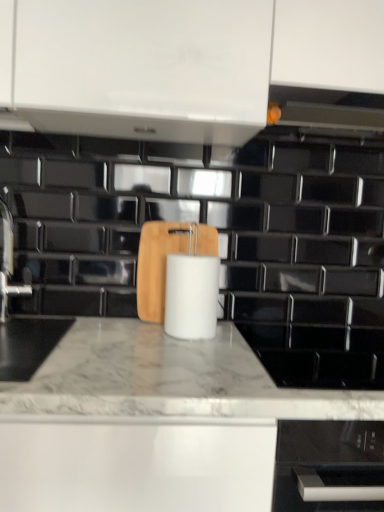
Question: In terms of width, does wooden cutting board at center look wider or thinner when compared to satin nickel faucet at left?

Choices:
 (A) wide
 (B) thin

Answer: (B)

Question: From a real-world perspective, is wooden cutting board at center physically located above or below satin nickel faucet at left?

Choices:
 (A) below
 (B) above

Answer: (A)

Question: Which is farther from the wooden cutting board at center?

Choices:
 (A) white matte paper towel at center
 (B) satin nickel faucet at left
 (C) white marble countertop at center

Answer: (C)

Question: Considering the real-world distances, which object is closest to the satin nickel faucet at left?

Choices:
 (A) white marble countertop at center
 (B) wooden cutting board at center
 (C) white matte paper towel at center

Answer: (B)